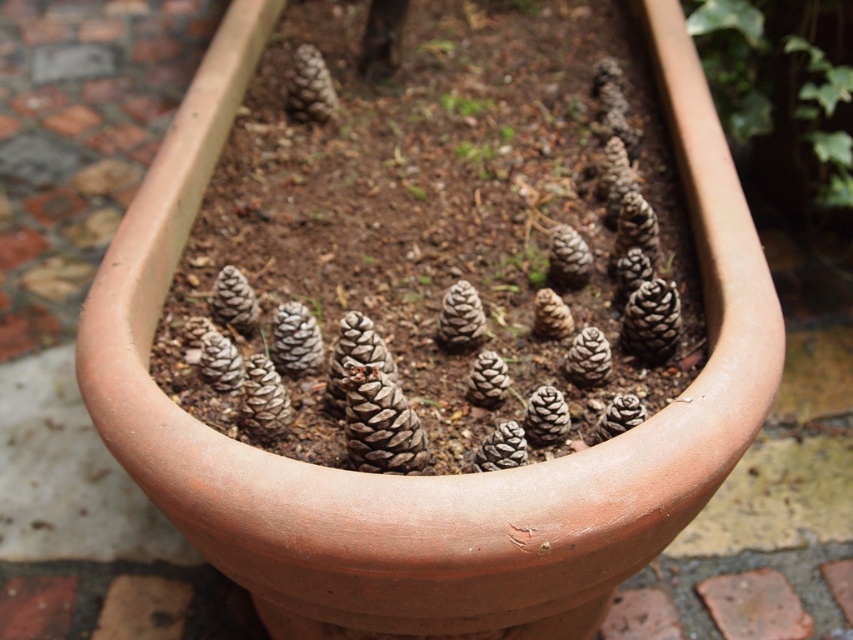
You are a gardener who wants to plant a new flower in the planter. The flower requires a spot that is taller than the green fuzzy plant at center. Can you use the area near the green matte ivy at upper right?

The green matte ivy at upper right has a greater height compared to the green fuzzy plant at center, so the area near the green matte ivy at upper right is taller than the green fuzzy plant at center. Therefore, you can use the area near the green matte ivy at upper right for planting the flower that requires a taller spot.